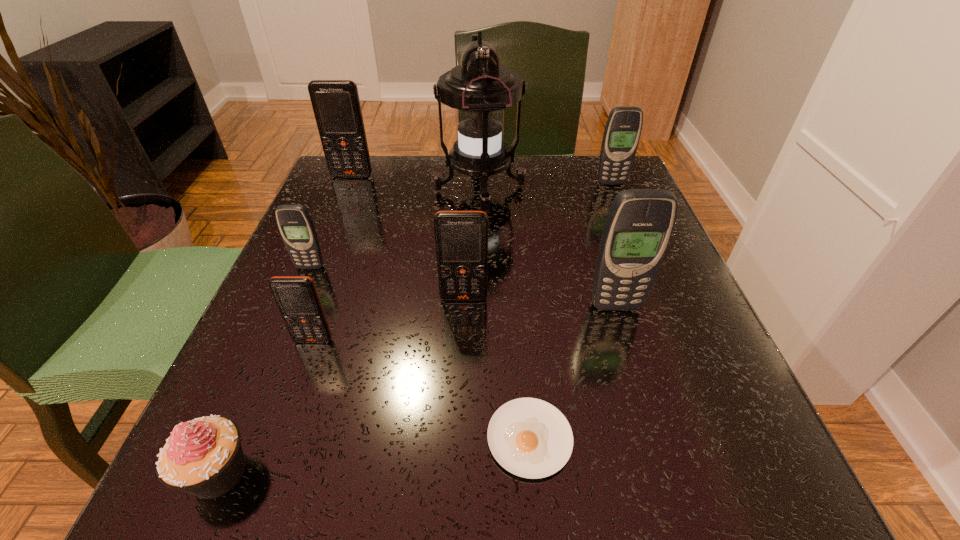
This screenshot has width=960, height=540. In order to click on object located in the far left corner section of the desktop in this screenshot , I will do `click(336, 104)`.

Identify the location of object situated at the near left corner. (204, 457).

Identify the location of object situated at the far right corner. This screenshot has width=960, height=540. (623, 128).

What are the coordinates of `vacant region at the far edge of the desktop` in the screenshot? It's located at (410, 162).

Where is `free space at the near edge`? free space at the near edge is located at coordinates (562, 507).

Identify the location of vacant space at the left edge of the desktop. The image size is (960, 540). (283, 269).

You are a GUI agent. You are given a task and a screenshot of the screen. Output one action in this format:
    pyautogui.click(x=<x>, y=<y>)
    Task: Click on the vacant space at the right edge of the desktop
    
    Given the screenshot: What is the action you would take?
    pyautogui.click(x=646, y=333)

You are a GUI agent. You are given a task and a screenshot of the screen. Output one action in this format:
    pyautogui.click(x=<x>, y=<y>)
    Task: Click on the vacant space at the near left corner
    
    Given the screenshot: What is the action you would take?
    pyautogui.click(x=280, y=495)

The width and height of the screenshot is (960, 540). In the image, there is a desktop. In order to click on free region at the far right corner in this screenshot , I will do `click(588, 157)`.

At what (x,y) coordinates should I click in order to perform the action: click on vacant space at the near right corner. Please return your answer as a coordinate pair (x, y). This screenshot has width=960, height=540. Looking at the image, I should click on (x=767, y=453).